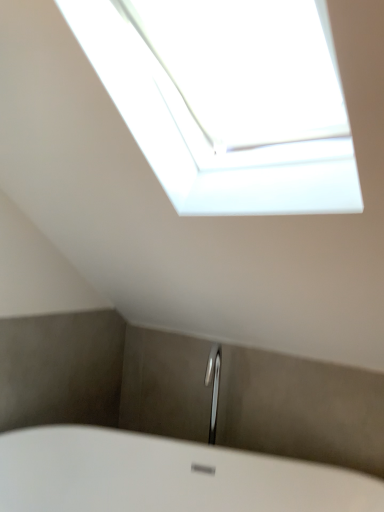
Question: Considering the positions of white glossy bathtub at lower center and transparent glass window at upper center in the image, is white glossy bathtub at lower center wider or thinner than transparent glass window at upper center?

Choices:
 (A) wide
 (B) thin

Answer: (B)

Question: From the image's perspective, is white glossy bathtub at lower center located above or below transparent glass window at upper center?

Choices:
 (A) below
 (B) above

Answer: (A)

Question: Visually, is white glossy bathtub at lower center positioned to the left or to the right of transparent glass window at upper center?

Choices:
 (A) left
 (B) right

Answer: (A)

Question: From the image's perspective, is transparent glass window at upper center above or below white glossy bathtub at lower center?

Choices:
 (A) below
 (B) above

Answer: (B)

Question: From a real-world perspective, is transparent glass window at upper center physically located above or below white glossy bathtub at lower center?

Choices:
 (A) above
 (B) below

Answer: (A)

Question: Is transparent glass window at upper center taller or shorter than white glossy bathtub at lower center?

Choices:
 (A) tall
 (B) short

Answer: (A)

Question: Which is correct: transparent glass window at upper center is inside white glossy bathtub at lower center, or outside of it?

Choices:
 (A) inside
 (B) outside

Answer: (B)